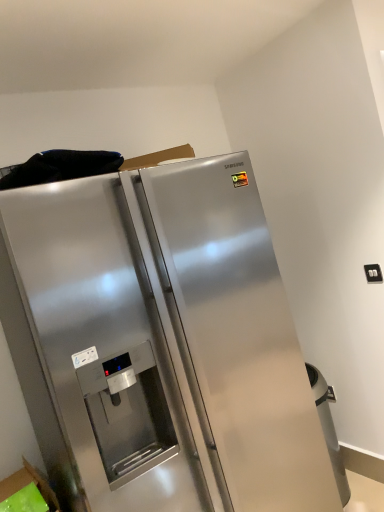
Image resolution: width=384 pixels, height=512 pixels. What do you see at coordinates (160, 343) in the screenshot? I see `stainless steel refrigerator at left` at bounding box center [160, 343].

Where is `stainless steel refrigerator at left`? The width and height of the screenshot is (384, 512). stainless steel refrigerator at left is located at coordinates (160, 343).

What is the approximate width of stainless steel refrigerator at left?

The width of stainless steel refrigerator at left is 32.18 inches.

Identify the location of stainless steel refrigerator at left. (160, 343).